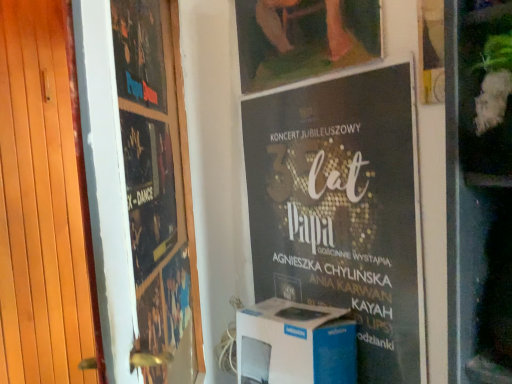
Question: Does white cardboard box at center turn towards matte black poster at upper left, the third poster positioned from the right?

Choices:
 (A) no
 (B) yes

Answer: (A)

Question: Would you consider white cardboard box at center to be distant from matte black poster at upper left, placed as the first poster when sorted from left to right?

Choices:
 (A) no
 (B) yes

Answer: (A)

Question: Is white cardboard box at center further to camera compared to matte black poster at upper left, placed as the first poster when sorted from left to right?

Choices:
 (A) no
 (B) yes

Answer: (B)

Question: Does white cardboard box at center touch matte black poster at upper left, the third poster positioned from the right?

Choices:
 (A) yes
 (B) no

Answer: (B)

Question: Is white cardboard box at center to the left of matte black poster at upper left, the third poster positioned from the right, from the viewer's perspective?

Choices:
 (A) yes
 (B) no

Answer: (B)

Question: Is white cardboard box at center smaller than matte black poster at upper left, placed as the first poster when sorted from left to right?

Choices:
 (A) no
 (B) yes

Answer: (A)

Question: Is matte wooden picture frame at upper center behind wooden at left?

Choices:
 (A) yes
 (B) no

Answer: (A)

Question: Considering the relative sizes of matte wooden picture frame at upper center and wooden at left in the image provided, is matte wooden picture frame at upper center taller than wooden at left?

Choices:
 (A) yes
 (B) no

Answer: (B)

Question: Is matte wooden picture frame at upper center far away from wooden at left?

Choices:
 (A) yes
 (B) no

Answer: (A)

Question: Is wooden at left at the back of matte wooden picture frame at upper center?

Choices:
 (A) no
 (B) yes

Answer: (A)

Question: Is matte wooden picture frame at upper center positioned in front of wooden at left?

Choices:
 (A) yes
 (B) no

Answer: (B)

Question: From a real-world perspective, does matte wooden picture frame at upper center stand above wooden at left?

Choices:
 (A) yes
 (B) no

Answer: (A)

Question: From a real-world perspective, is matte black poster at left, placed as the 2th poster when sorted from left to right, positioned over matte wooden picture frame at upper center based on gravity?

Choices:
 (A) no
 (B) yes

Answer: (A)